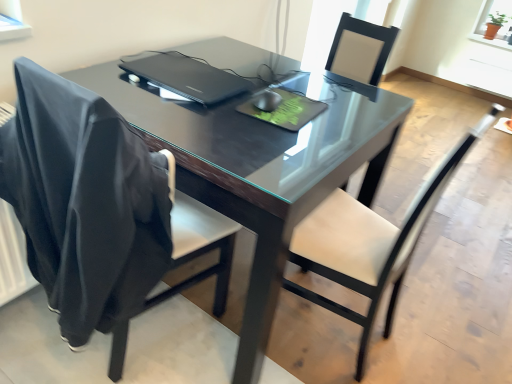
Question: From a real-world perspective, is black leather chair at left, the 2th chair from the right, over glossy black table at center?

Choices:
 (A) no
 (B) yes

Answer: (B)

Question: Could you tell me if black leather chair at left, which is the first chair in left-to-right order, is turned towards glossy black table at center?

Choices:
 (A) no
 (B) yes

Answer: (B)

Question: Does black leather chair at left, which is the first chair in left-to-right order, contain glossy black table at center?

Choices:
 (A) yes
 (B) no

Answer: (B)

Question: Can you confirm if black leather chair at left, the 2th chair from the right, is wider than glossy black table at center?

Choices:
 (A) no
 (B) yes

Answer: (A)

Question: From the image's perspective, is black leather chair at left, the 2th chair from the right, over glossy black table at center?

Choices:
 (A) no
 (B) yes

Answer: (A)

Question: In the image, is black leather chair at left, the 2th chair from the right, on the left side or the right side of terracotta clay pot at upper right?

Choices:
 (A) right
 (B) left

Answer: (B)

Question: Is point (28, 144) closer or farther from the camera than point (496, 8)?

Choices:
 (A) farther
 (B) closer

Answer: (B)

Question: From the image's perspective, is black leather chair at left, which is the first chair in left-to-right order, positioned above or below terracotta clay pot at upper right?

Choices:
 (A) above
 (B) below

Answer: (B)

Question: Is black leather chair at left, the 2th chair from the right, situated inside terracotta clay pot at upper right or outside?

Choices:
 (A) inside
 (B) outside

Answer: (B)

Question: From a real-world perspective, is white leather chair at center, which is the 1th chair from right to left, above or below black leather chair at left, the 2th chair from the right?

Choices:
 (A) above
 (B) below

Answer: (B)

Question: Is white leather chair at center, which is the 1th chair from right to left, spatially inside black leather chair at left, which is the first chair in left-to-right order, or outside of it?

Choices:
 (A) inside
 (B) outside

Answer: (B)

Question: From the image's perspective, is white leather chair at center, which is the 2th chair in left-to-right order, above or below black leather chair at left, the 2th chair from the right?

Choices:
 (A) above
 (B) below

Answer: (B)

Question: In the image, is white leather chair at center, which is the 1th chair from right to left, on the left side or the right side of black leather chair at left, the 2th chair from the right?

Choices:
 (A) left
 (B) right

Answer: (B)

Question: Choose the correct answer: Is black plastic laptop at center inside terracotta clay pot at upper right or outside it?

Choices:
 (A) inside
 (B) outside

Answer: (B)

Question: In the image, is black plastic laptop at center positioned in front of or behind terracotta clay pot at upper right?

Choices:
 (A) front
 (B) behind

Answer: (A)